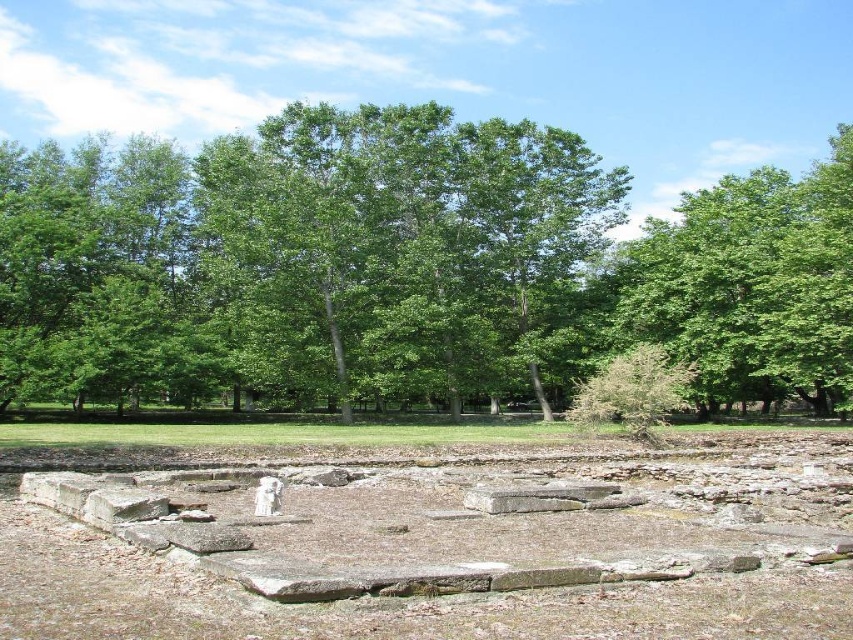
Who is more forward, (753,256) or (706,598)?

Positioned in front is point (706,598).

Which is more to the right, green leafy tree at center or brown stone dirt field at center?

Positioned to the right is green leafy tree at center.

Locate an element on the screen. The height and width of the screenshot is (640, 853). green leafy tree at center is located at coordinates (407, 268).